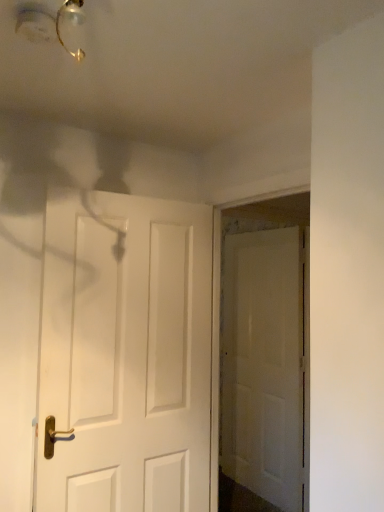
Question: Should I look upward or downward to see matte gold light fixture at upper left?

Choices:
 (A) up
 (B) down

Answer: (A)

Question: Considering the relative positions of matte gold light fixture at upper left and white matte door at center, the second door positioned from the back, in the image provided, is matte gold light fixture at upper left to the right of white matte door at center, the second door positioned from the back, from the viewer's perspective?

Choices:
 (A) yes
 (B) no

Answer: (B)

Question: Is white matte door at center, the second door positioned from the back, inside matte gold light fixture at upper left?

Choices:
 (A) yes
 (B) no

Answer: (B)

Question: Is matte gold light fixture at upper left shorter than white matte door at center, acting as the first door starting from the left?

Choices:
 (A) no
 (B) yes

Answer: (B)

Question: Is the depth of matte gold light fixture at upper left greater than that of white matte door at center, the second door positioned from the back?

Choices:
 (A) no
 (B) yes

Answer: (A)

Question: Is white matte door at center, acting as the first door starting from the left, at the back of matte gold light fixture at upper left?

Choices:
 (A) yes
 (B) no

Answer: (B)

Question: From the image's perspective, is matte gold light fixture at upper left under white matte door at center, the second door positioned from the back?

Choices:
 (A) yes
 (B) no

Answer: (B)

Question: Could you tell me if white matte door at center, the second door positioned from the back, is facing matte gold light fixture at upper left?

Choices:
 (A) no
 (B) yes

Answer: (A)

Question: Does white matte door at center, the second door positioned from the back, lie behind matte gold light fixture at upper left?

Choices:
 (A) yes
 (B) no

Answer: (A)

Question: From the image's perspective, does white matte door at center, the second door positioned from the back, appear lower than matte gold light fixture at upper left?

Choices:
 (A) yes
 (B) no

Answer: (A)

Question: From a real-world perspective, is white matte door at center, the second door positioned from the back, positioned over matte gold light fixture at upper left based on gravity?

Choices:
 (A) yes
 (B) no

Answer: (B)

Question: Does white matte door at center, marked as the first door in a front-to-back arrangement, have a greater height compared to matte gold light fixture at upper left?

Choices:
 (A) no
 (B) yes

Answer: (B)

Question: Considering the relative sizes of white matte door at center, acting as the first door starting from the left, and matte gold light fixture at upper left in the image provided, is white matte door at center, acting as the first door starting from the left, shorter than matte gold light fixture at upper left?

Choices:
 (A) yes
 (B) no

Answer: (B)

Question: Considering the relative positions of white matte door at center, placed as the first door when sorted from back to front, and matte gold light fixture at upper left in the image provided, is white matte door at center, placed as the first door when sorted from back to front, behind matte gold light fixture at upper left?

Choices:
 (A) no
 (B) yes

Answer: (B)